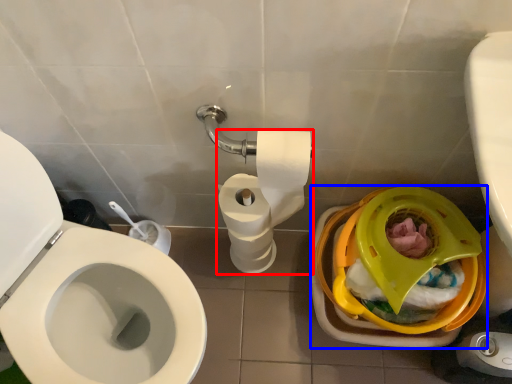
Question: Which point is closer to the camera, toilet paper (highlighted by a red box) or potty (highlighted by a blue box)?

Choices:
 (A) toilet paper
 (B) potty

Answer: (B)